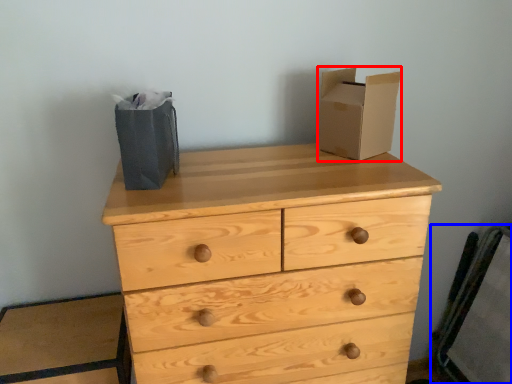
Question: Among these objects, which one is farthest to the camera, cardboard box (highlighted by a red box) or chair (highlighted by a blue box)?

Choices:
 (A) cardboard box
 (B) chair

Answer: (B)